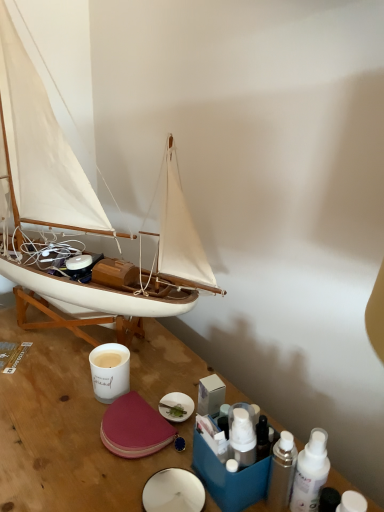
Locate an element on the screen. free location in front of white matte cup at center is located at coordinates (72, 459).